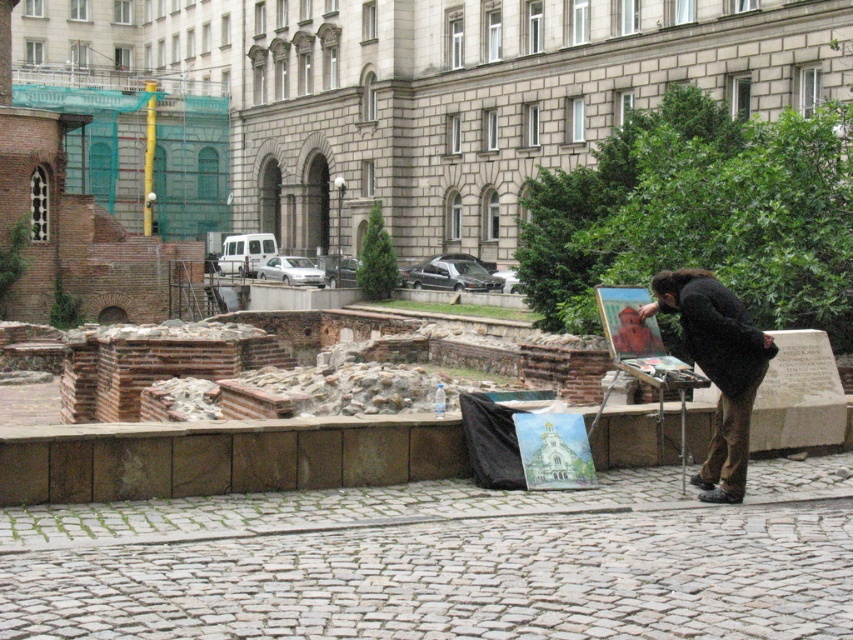
You are a city planner assessing the historical site. You need to place a new information board that must be narrower than the black fabric at right but wider than the wooden easel at center. Is this possible?

The black fabric at right might be wider than the wooden easel at center. Therefore, it is possible to place an information board narrower than the black fabric at right but wider than the wooden easel at center if the fabric is indeed wider.

You are a photographer standing next to the black fabric at right. You want to take a photo of the camera. Can you reach the camera without moving from your current position?

The black fabric at right and camera are 30.66 feet apart. Since you are standing next to the black fabric at right, the camera is 30.66 feet away, which is too far to reach without moving.